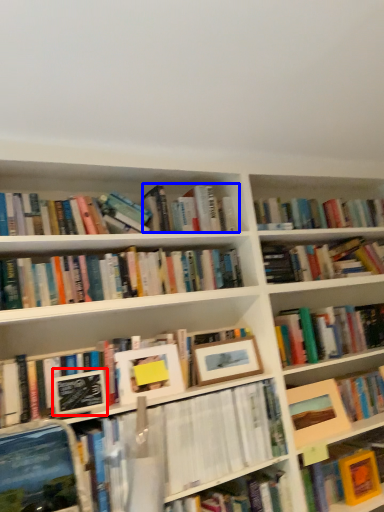
Question: Which of the following is the closest to the observer, paperback book (highlighted by a red box) or book (highlighted by a blue box)?

Choices:
 (A) paperback book
 (B) book

Answer: (A)